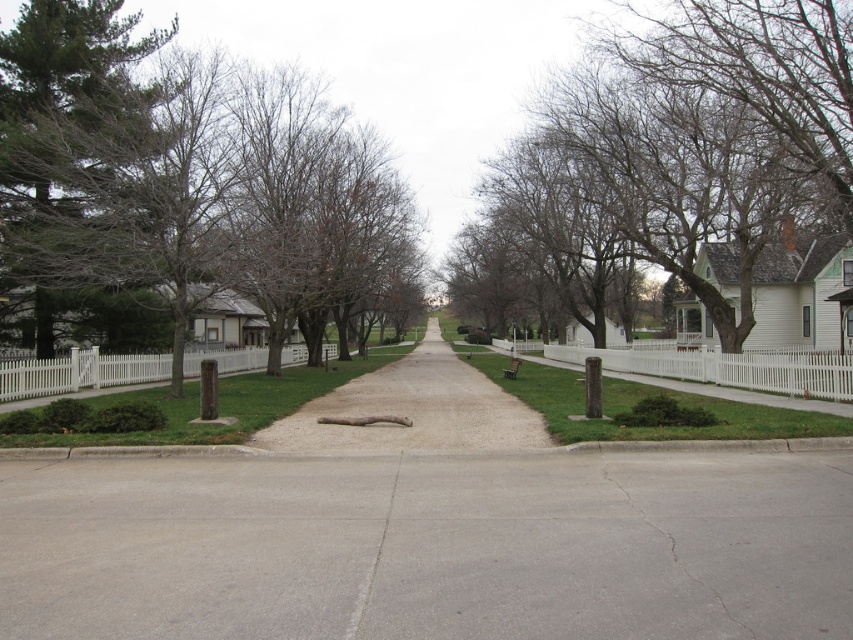
Is gray concrete pavement at center further to camera compared to gray concrete crack at center?

No.

The image size is (853, 640). Describe the element at coordinates (428, 547) in the screenshot. I see `gray concrete pavement at center` at that location.

This screenshot has width=853, height=640. Find the location of `gray concrete pavement at center`. gray concrete pavement at center is located at coordinates pyautogui.click(x=428, y=547).

You are a GUI agent. You are given a task and a screenshot of the screen. Output one action in this format:
    pyautogui.click(x=<x>, y=<y>)
    Task: Click on the gray concrete pavement at center
    The image size is (853, 640).
    Given the screenshot: What is the action you would take?
    pyautogui.click(x=428, y=547)

Is green leafy tree at left bigger than gravel driveway at center?

Yes, green leafy tree at left is bigger than gravel driveway at center.

Is green leafy tree at left smaller than gravel driveway at center?

Actually, green leafy tree at left might be larger than gravel driveway at center.

Between point (138, 92) and point (366, 436), which one is positioned in front?

Positioned in front is point (366, 436).

Identify the location of green leafy tree at left. (206, 193).

In the scene shown: Does green leafy tree at left appear on the left side of gray concrete crack at center?

Correct, you'll find green leafy tree at left to the left of gray concrete crack at center.

Is the position of green leafy tree at left more distant than that of gray concrete crack at center?

Yes, it is behind gray concrete crack at center.

Is point (233, 182) less distant than point (387, 508)?

No, it is behind (387, 508).

This screenshot has height=640, width=853. Find the location of `green leafy tree at left`. green leafy tree at left is located at coordinates (206, 193).